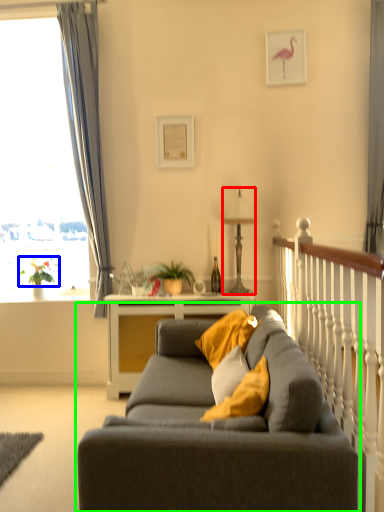
Question: Based on their relative distances, which object is farther from lamp (highlighted by a red box)? Choose from plant (highlighted by a blue box) and studio couch (highlighted by a green box).

Choices:
 (A) plant
 (B) studio couch

Answer: (B)